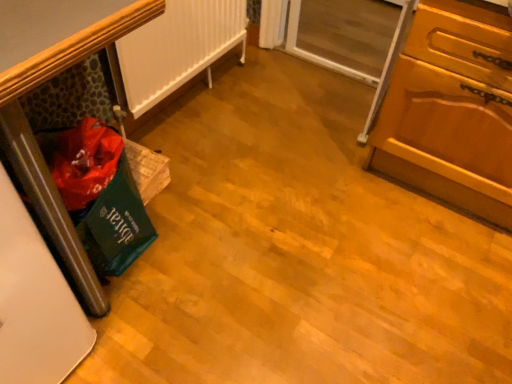
Image resolution: width=512 pixels, height=384 pixels. What do you see at coordinates (38, 147) in the screenshot?
I see `green fabric bag at left` at bounding box center [38, 147].

In the scene shown: In order to face white matte radiator at left, should I rotate leftwards or rightwards?

Rotate left and turn 8.569 degrees.

Describe the element at coordinates (178, 48) in the screenshot. This screenshot has width=512, height=384. I see `white matte radiator at left` at that location.

Locate an element on the screen. This screenshot has height=384, width=512. transparent glass screen door at upper right is located at coordinates (343, 35).

Relative to wooden cabinet at right, is green fabric bag at left in front or behind?

Visually, green fabric bag at left is located behind wooden cabinet at right.

From the image's perspective, does green fabric bag at left appear higher than wooden cabinet at right?

Actually, green fabric bag at left appears below wooden cabinet at right in the image.

Is green fabric bag at left directly adjacent to wooden cabinet at right?

No, green fabric bag at left is not making contact with wooden cabinet at right.

From a real-world perspective, is green fabric bag at left physically above wooden cabinet at right?

No, from a real-world perspective, green fabric bag at left is not over wooden cabinet at right

Identify the location of furniture to the left of transparent glass screen door at upper right. pyautogui.click(x=38, y=147).

Is transparent glass screen door at upper right with green fabric bag at left?

There is a gap between transparent glass screen door at upper right and green fabric bag at left.

Is transparent glass screen door at upper right turned away from green fabric bag at left?

No, green fabric bag at left is not at the back of transparent glass screen door at upper right.

Is transparent glass screen door at upper right shorter than green fabric bag at left?

Incorrect, the height of transparent glass screen door at upper right does not fall short of that of green fabric bag at left.

Is the position of white matte radiator at left more distant than that of transparent glass screen door at upper right?

No, it is in front of transparent glass screen door at upper right.

Is white matte radiator at left oriented towards transparent glass screen door at upper right?

No, white matte radiator at left is not turned towards transparent glass screen door at upper right.

Would you say white matte radiator at left is outside transparent glass screen door at upper right?

Absolutely, white matte radiator at left is external to transparent glass screen door at upper right.

Is wooden cabinet at right completely or partially outside of transparent glass screen door at upper right?

Indeed, wooden cabinet at right is completely outside transparent glass screen door at upper right.

Is wooden cabinet at right not close to transparent glass screen door at upper right?

That's not correct — wooden cabinet at right is a little close to transparent glass screen door at upper right.

Between wooden cabinet at right and transparent glass screen door at upper right, which one has larger width?

wooden cabinet at right is wider.

Could you tell me if wooden cabinet at right is turned towards transparent glass screen door at upper right?

No, wooden cabinet at right is not aimed at transparent glass screen door at upper right.

Which of these two, green fabric bag at left or transparent glass screen door at upper right, is wider?

With larger width is green fabric bag at left.

Does green fabric bag at left have a larger size compared to transparent glass screen door at upper right?

Yes, green fabric bag at left is bigger than transparent glass screen door at upper right.

Identify the location of furniture directly beneath the transparent glass screen door at upper right (from a real-world perspective). The height and width of the screenshot is (384, 512). (38, 147).

Do you think wooden cabinet at right is within white matte radiator at left, or outside of it?

wooden cabinet at right is not enclosed by white matte radiator at left.

Which is closer, (428, 140) or (152, 40)?

Clearly, point (428, 140) is closer to the camera than point (152, 40).

Considering the sizes of wooden cabinet at right and white matte radiator at left in the image, is wooden cabinet at right taller or shorter than white matte radiator at left?

Considering their sizes, wooden cabinet at right has more height than white matte radiator at left.

Which object is positioned more to the left, wooden cabinet at right or white matte radiator at left?

From the viewer's perspective, white matte radiator at left appears more on the left side.

From the image's perspective, which is above, transparent glass screen door at upper right or white matte radiator at left?

transparent glass screen door at upper right is shown above in the image.

Considering the sizes of objects transparent glass screen door at upper right and white matte radiator at left in the image provided, who is thinner, transparent glass screen door at upper right or white matte radiator at left?

transparent glass screen door at upper right is thinner.

Is transparent glass screen door at upper right spatially inside white matte radiator at left, or outside of it?

The correct answer is: outside.

Measure the distance from transparent glass screen door at upper right to white matte radiator at left.

The distance of transparent glass screen door at upper right from white matte radiator at left is 29.19 inches.

Image resolution: width=512 pixels, height=384 pixels. I want to click on cabinetry in front of the green fabric bag at left, so click(451, 110).

Where is `screen door located above the green fabric bag at left (from a real-world perspective)`? Image resolution: width=512 pixels, height=384 pixels. screen door located above the green fabric bag at left (from a real-world perspective) is located at coordinates click(343, 35).

Estimate the real-world distances between objects in this image. Which object is closer to wooden cabinet at right, transparent glass screen door at upper right or green fabric bag at left?

transparent glass screen door at upper right.

Which object lies nearer to the anchor point green fabric bag at left, transparent glass screen door at upper right or white matte radiator at left?

white matte radiator at left.

Estimate the real-world distances between objects in this image. Which object is further from transparent glass screen door at upper right, green fabric bag at left or wooden cabinet at right?

Based on the image, green fabric bag at left appears to be further to transparent glass screen door at upper right.

Consider the image. When comparing their distances from green fabric bag at left, does wooden cabinet at right or white matte radiator at left seem further?

Among the two, wooden cabinet at right is located further to green fabric bag at left.

Which object lies nearer to the anchor point white matte radiator at left, transparent glass screen door at upper right or green fabric bag at left?

transparent glass screen door at upper right lies closer to white matte radiator at left than the other object.

Looking at the image, which one is located further to wooden cabinet at right, white matte radiator at left or green fabric bag at left?

green fabric bag at left.

Based on their spatial positions, is wooden cabinet at right or transparent glass screen door at upper right closer to white matte radiator at left?

transparent glass screen door at upper right.

From the picture: Looking at the image, which one is located further to wooden cabinet at right, green fabric bag at left or white matte radiator at left?

green fabric bag at left is further to wooden cabinet at right.

Where is `radiator between green fabric bag at left and transparent glass screen door at upper right`? This screenshot has width=512, height=384. radiator between green fabric bag at left and transparent glass screen door at upper right is located at coordinates (178, 48).

Identify the location of radiator situated between green fabric bag at left and wooden cabinet at right from left to right. (178, 48).

Identify the location of screen door situated between green fabric bag at left and wooden cabinet at right from left to right. (343, 35).

Find the location of a particular element. The width and height of the screenshot is (512, 384). screen door between white matte radiator at left and wooden cabinet at right is located at coordinates (343, 35).